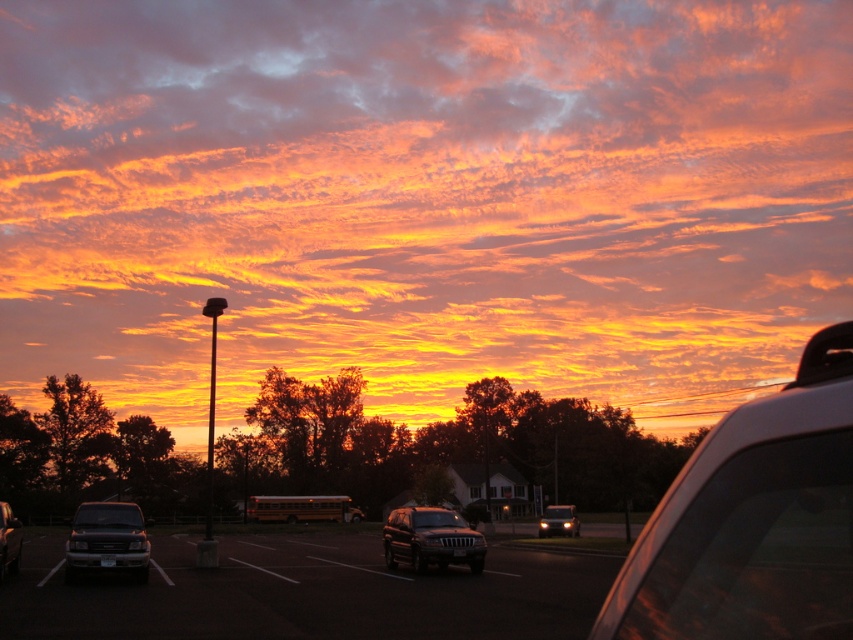
Does matte black suv at lower left have a greater height compared to satin black suv at center?

Incorrect, matte black suv at lower left's height is not larger of satin black suv at center's.

Between matte black suv at lower left and satin black suv at center, which one has more height?

Standing taller between the two is satin black suv at center.

Based on the photo, who is more distant from viewer, (106, 557) or (421, 547)?

The point (421, 547) is more distant.

Find the location of `matte black suv at lower left`. matte black suv at lower left is located at coordinates (107, 540).

Who is more forward, (680, 52) or (436, 536)?

Point (436, 536) is more forward.

Is point (529, 67) less distant than point (462, 561)?

No, it is behind (462, 561).

Which is in front, point (622, 362) or point (403, 561)?

Point (403, 561) is in front.

Locate an element on the screen. Image resolution: width=853 pixels, height=640 pixels. orange/yellow cloud at upper center is located at coordinates coord(421,198).

Does point (175, 397) come behind point (4, 612)?

Yes, point (175, 397) is behind point (4, 612).

Does point (762, 220) come closer to viewer compared to point (410, 602)?

No, (762, 220) is behind (410, 602).

What do you see at coordinates (421, 198) in the screenshot? The height and width of the screenshot is (640, 853). I see `orange/yellow cloud at upper center` at bounding box center [421, 198].

Identify the location of orange/yellow cloud at upper center. (421, 198).